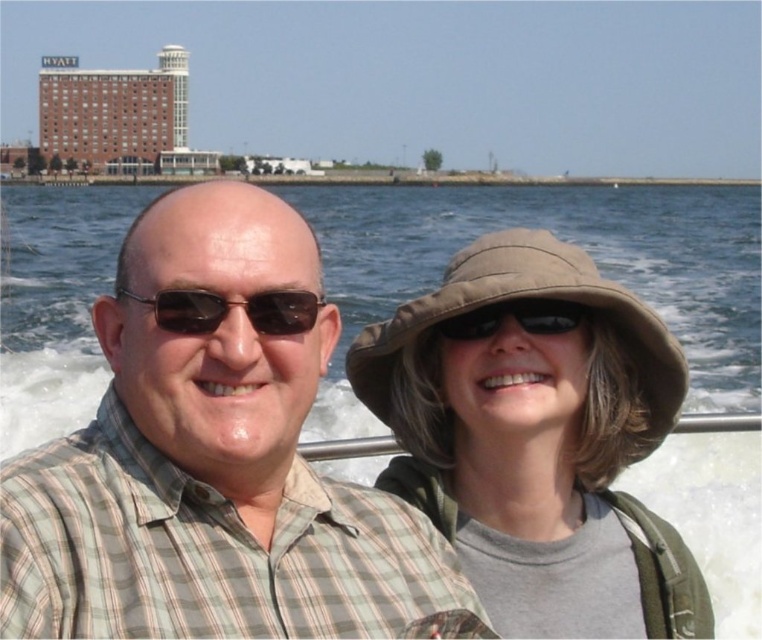
Question: Estimate the real-world distances between objects in this image. Which object is closer to the matte black goggles at upper center?

Choices:
 (A) checkered fabric shirt at center
 (B) brown fabric hat at center

Answer: (B)

Question: Which point is farther from the camera taking this photo?

Choices:
 (A) (187, 300)
 (B) (415, 577)
 (C) (511, 355)
 (D) (460, 326)

Answer: (D)

Question: Estimate the real-world distances between objects in this image. Which object is farther from the matte black sunglasses at center?

Choices:
 (A) brown fabric hat at center
 (B) checkered fabric shirt at center
 (C) matte black goggles at upper center
 (D) clear blue water at center

Answer: (D)

Question: Does brown fabric hat at center lie in front of matte black goggles at upper center?

Choices:
 (A) no
 (B) yes

Answer: (B)

Question: Is checkered fabric shirt at center thinner than matte black goggles at upper center?

Choices:
 (A) no
 (B) yes

Answer: (A)

Question: Can you confirm if checkered fabric shirt at center is positioned above brown fabric hat at center?

Choices:
 (A) no
 (B) yes

Answer: (B)